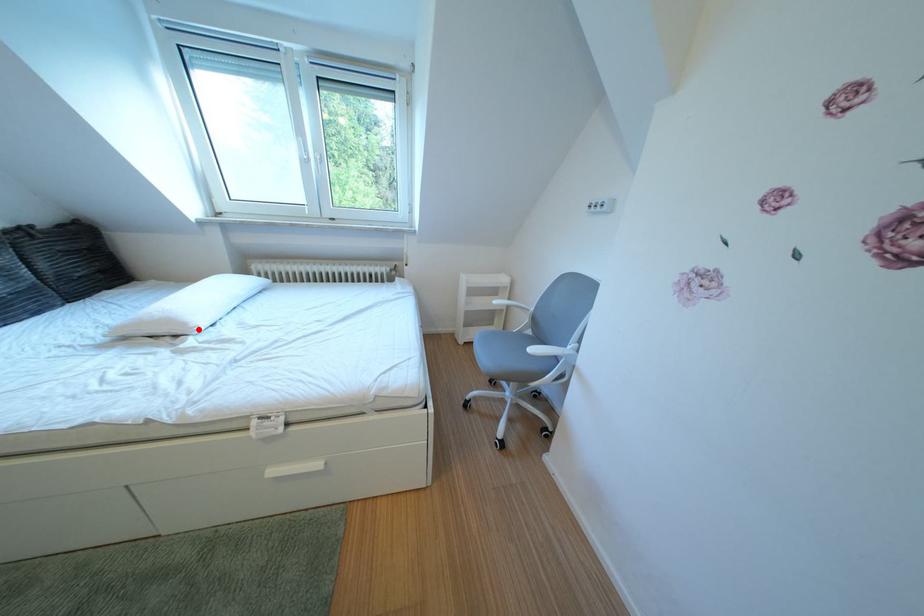
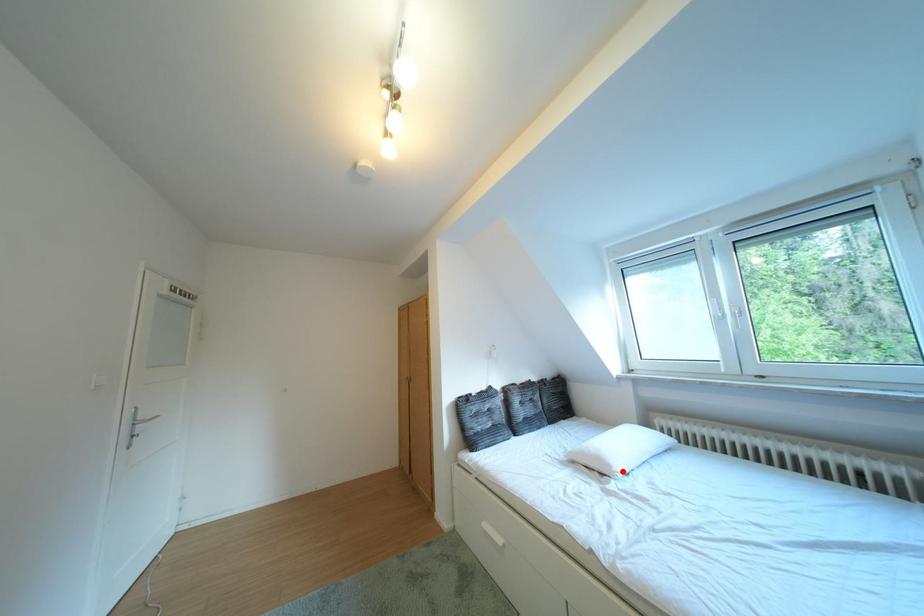
From the picture: I am providing you with two images of the same scene from different viewpoints. A red point is marked on the first image and another point is marked on the second image. Are the points marked in image1 and image2 representing the same 3D position?

Yes